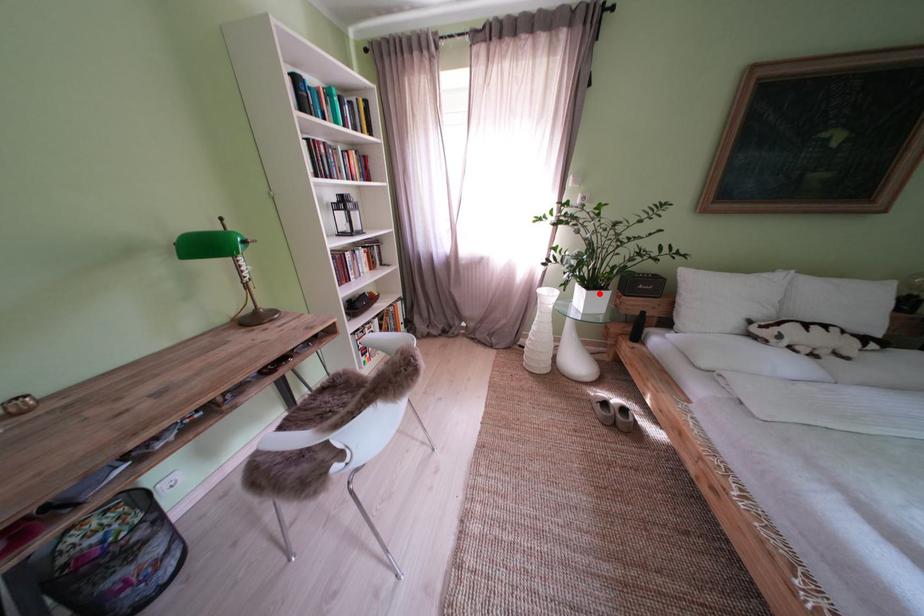
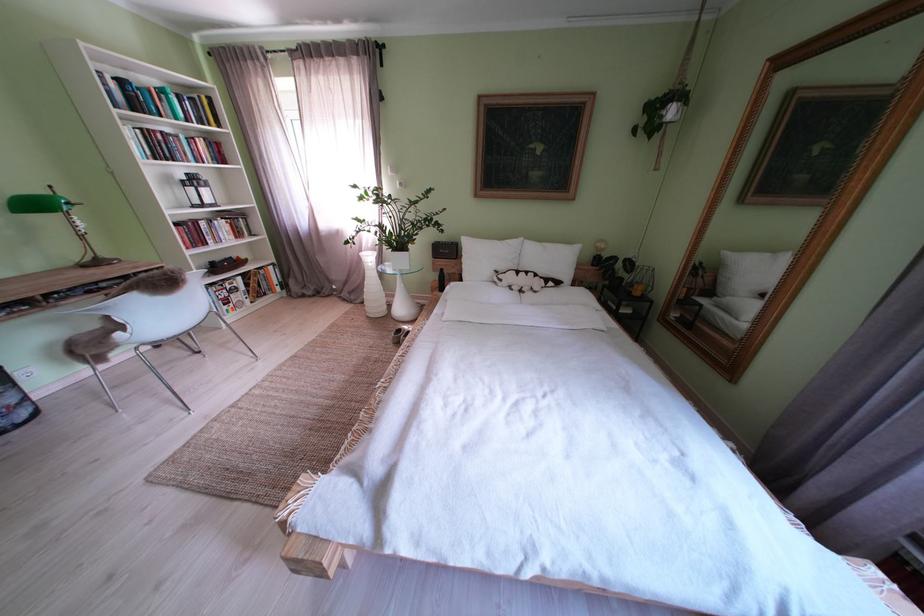
Where in the second image is the point corresponding to the highlighted location from the first image?

(405, 256)